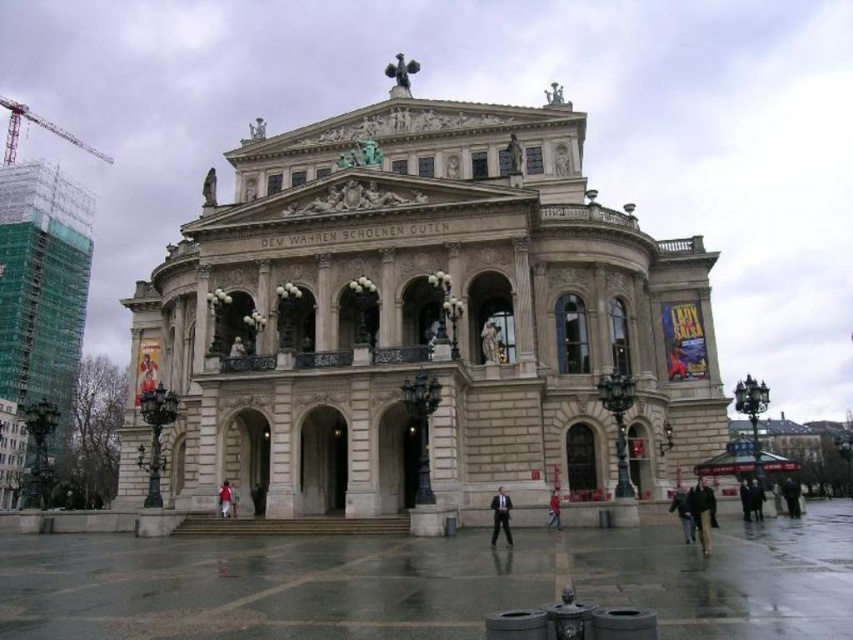
Question: Considering the real-world distances, which object is closest to the dark gray suit at lower right?

Choices:
 (A) dark brown leather jacket at lower right
 (B) dark gray suit at center
 (C) white fabric person at center

Answer: (A)

Question: Which object is the closest to the dark gray suit at center?

Choices:
 (A) dark gray suit at lower right
 (B) red fabric coat at center
 (C) dark brown leather coat at lower right

Answer: (B)

Question: In this image, where is white fabric person at center located relative to red fabric coat at center?

Choices:
 (A) right
 (B) left

Answer: (B)

Question: Does dark brown leather coat at lower right appear under dark brown leather jacket at lower right?

Choices:
 (A) no
 (B) yes

Answer: (A)

Question: Is dark brown leather jacket at lower right further to camera compared to dark gray suit at lower right?

Choices:
 (A) no
 (B) yes

Answer: (A)

Question: Estimate the real-world distances between objects in this image. Which object is farther from the white fabric person at center?

Choices:
 (A) dark brown leather coat at lower right
 (B) dark gray suit at lower right

Answer: (B)